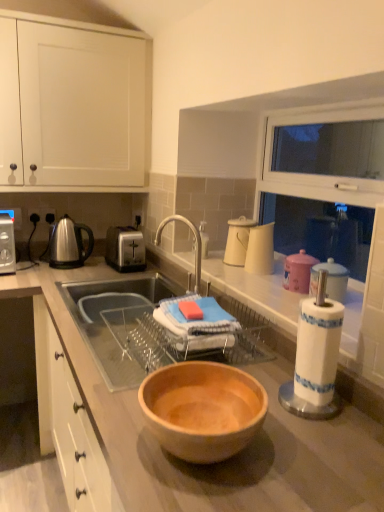
Question: Is white glossy pitcher at upper right, which appears as the second appliance when viewed from the front, oriented towards white paper towel holder at right, the third appliance in the back-to-front sequence?

Choices:
 (A) yes
 (B) no

Answer: (B)

Question: Does white glossy pitcher at upper right, which is counted as the 2th appliance, starting from the back, lie in front of white paper towel holder at right, arranged as the first appliance when viewed from the front?

Choices:
 (A) no
 (B) yes

Answer: (A)

Question: Can you confirm if white glossy pitcher at upper right, which appears as the second appliance when viewed from the front, is thinner than white paper towel holder at right, arranged as the first appliance when viewed from the front?

Choices:
 (A) yes
 (B) no

Answer: (B)

Question: From a real-world perspective, is white glossy pitcher at upper right, which appears as the second appliance when viewed from the front, positioned over white paper towel holder at right, the third appliance in the back-to-front sequence, based on gravity?

Choices:
 (A) yes
 (B) no

Answer: (A)

Question: Is white paper towel holder at right, arranged as the first appliance when viewed from the front, surrounded by white glossy pitcher at upper right, which appears as the second appliance when viewed from the front?

Choices:
 (A) no
 (B) yes

Answer: (A)

Question: Does white glossy pitcher at upper right, which appears as the second appliance when viewed from the front, have a smaller size compared to white paper towel holder at right, the third appliance in the back-to-front sequence?

Choices:
 (A) no
 (B) yes

Answer: (A)

Question: Can you confirm if white glossy pitcher at upper right, which is counted as the 2th appliance, starting from the back, is shorter than white matte cabinet at upper right, the 2th cabinetry in the left-to-right sequence?

Choices:
 (A) no
 (B) yes

Answer: (B)

Question: Is white glossy pitcher at upper right, which appears as the second appliance when viewed from the front, positioned behind white matte cabinet at upper right, the 2th cabinetry in the left-to-right sequence?

Choices:
 (A) yes
 (B) no

Answer: (A)

Question: From a real-world perspective, is white glossy pitcher at upper right, which appears as the second appliance when viewed from the front, beneath white matte cabinet at upper right, the 2th cabinetry in the left-to-right sequence?

Choices:
 (A) no
 (B) yes

Answer: (B)

Question: Is white matte cabinet at upper right, the 2th cabinetry in the left-to-right sequence, completely or partially inside white glossy pitcher at upper right, which appears as the second appliance when viewed from the front?

Choices:
 (A) yes
 (B) no

Answer: (B)

Question: Does white glossy pitcher at upper right, which appears as the second appliance when viewed from the front, have a greater height compared to white matte cabinet at upper right, placed as the 1th cabinetry when sorted from right to left?

Choices:
 (A) no
 (B) yes

Answer: (A)

Question: From the image's perspective, is white glossy pitcher at upper right, which is counted as the 2th appliance, starting from the back, located above white matte cabinet at upper right, the 2th cabinetry in the left-to-right sequence?

Choices:
 (A) no
 (B) yes

Answer: (A)

Question: Does white glossy cups at upper center, the 1th appliance when ordered from back to front, have a smaller size compared to white glossy pitcher at upper right, which is counted as the 2th appliance, starting from the back?

Choices:
 (A) no
 (B) yes

Answer: (A)